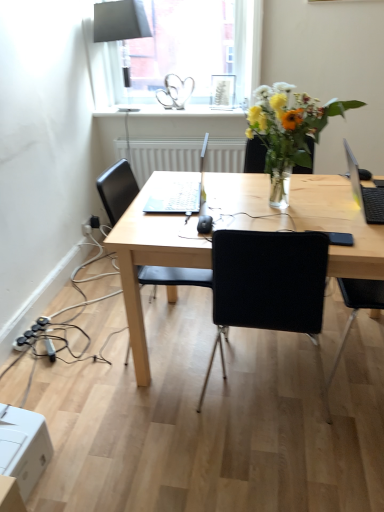
Identify the location of free location to the left of translucent glass vase at upper right. (222, 207).